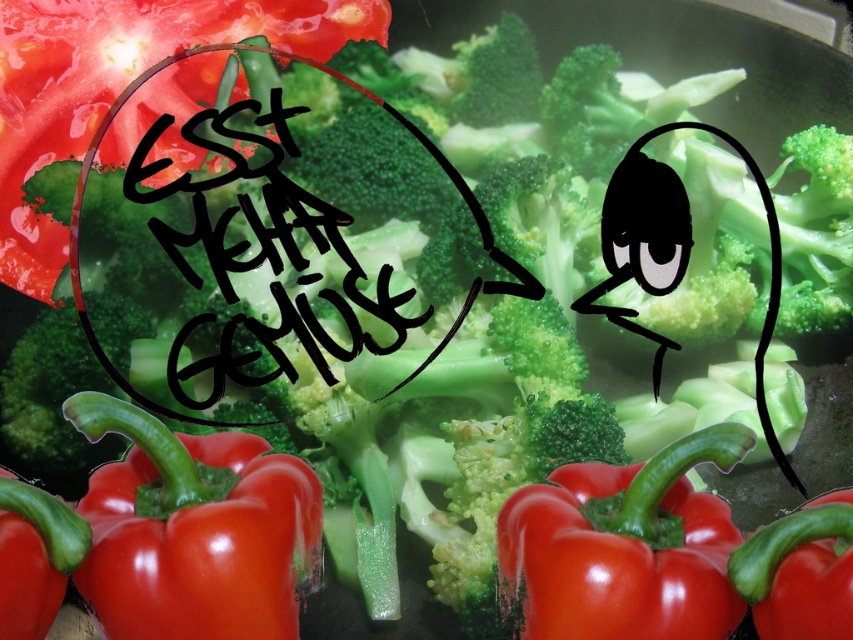
Question: Which point is farther to the camera?

Choices:
 (A) (819, 520)
 (B) (161, 51)
 (C) (178, 627)

Answer: (B)

Question: Is shiny red bell pepper at lower left positioned behind smooth red bell pepper at lower left?

Choices:
 (A) yes
 (B) no

Answer: (A)

Question: Observing the image, what is the correct spatial positioning of shiny red bell pepper at lower left in reference to glossy red bell pepper at center?

Choices:
 (A) right
 (B) left

Answer: (B)

Question: Estimate the real-world distances between objects in this image. Which object is farther from the shiny red tomato at upper left?

Choices:
 (A) smooth red bell pepper at lower left
 (B) shiny red bell pepper at lower left

Answer: (A)

Question: Is shiny red bell pepper at lower left bigger than glossy red bell pepper at center?

Choices:
 (A) yes
 (B) no

Answer: (A)

Question: Among these objects, which one is farthest from the camera?

Choices:
 (A) smooth red bell pepper at lower right
 (B) smooth red bell pepper at lower left

Answer: (A)